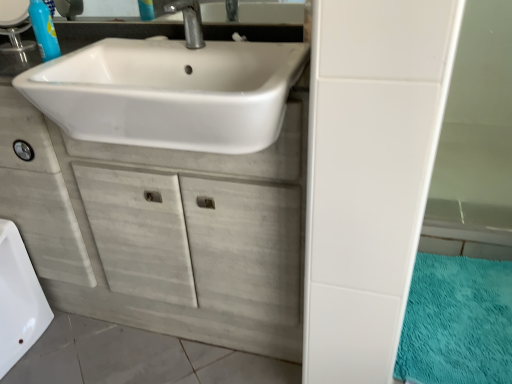
Question: Is metallic silver faucet at upper center located within teal plush bath mat at lower right?

Choices:
 (A) no
 (B) yes

Answer: (A)

Question: From the image's perspective, is teal plush bath mat at lower right located beneath metallic silver faucet at upper center?

Choices:
 (A) no
 (B) yes

Answer: (B)

Question: From a real-world perspective, is teal plush bath mat at lower right under metallic silver faucet at upper center?

Choices:
 (A) no
 (B) yes

Answer: (B)

Question: Can you see teal plush bath mat at lower right touching metallic silver faucet at upper center?

Choices:
 (A) no
 (B) yes

Answer: (A)

Question: Does teal plush bath mat at lower right have a greater width compared to metallic silver faucet at upper center?

Choices:
 (A) no
 (B) yes

Answer: (B)

Question: From a real-world perspective, is teal plush bath mat at lower right physically above metallic silver faucet at upper center?

Choices:
 (A) yes
 (B) no

Answer: (B)

Question: Is metallic silver faucet at upper center far away from white wood cabinet at center?

Choices:
 (A) no
 (B) yes

Answer: (A)

Question: Are metallic silver faucet at upper center and white wood cabinet at center making contact?

Choices:
 (A) yes
 (B) no

Answer: (B)

Question: Can you confirm if metallic silver faucet at upper center is taller than white wood cabinet at center?

Choices:
 (A) no
 (B) yes

Answer: (A)

Question: Considering the relative positions of metallic silver faucet at upper center and white wood cabinet at center in the image provided, is metallic silver faucet at upper center behind white wood cabinet at center?

Choices:
 (A) no
 (B) yes

Answer: (B)

Question: Is metallic silver faucet at upper center aimed at white wood cabinet at center?

Choices:
 (A) yes
 (B) no

Answer: (B)

Question: Can you confirm if metallic silver faucet at upper center is smaller than white wood cabinet at center?

Choices:
 (A) no
 (B) yes

Answer: (B)

Question: Does white glossy bath at lower left have a smaller size compared to white glossy sink at upper center?

Choices:
 (A) no
 (B) yes

Answer: (A)